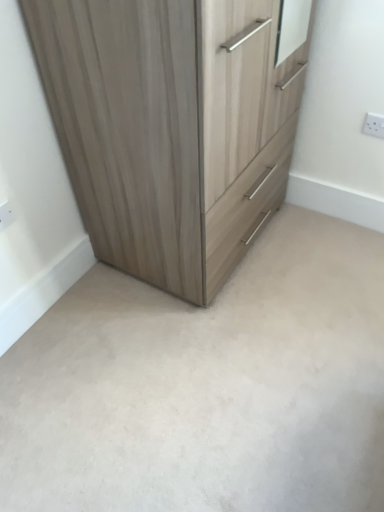
Locate an element on the screen. The image size is (384, 512). vacant space to the right of light wood/texture chest of drawers at upper left is located at coordinates [x=315, y=261].